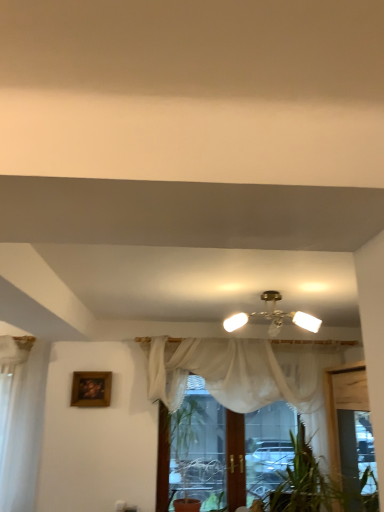
Describe the element at coordinates (91, 389) in the screenshot. I see `wooden framed painting at upper left` at that location.

The height and width of the screenshot is (512, 384). Find the location of `white sheer curtain at center`. white sheer curtain at center is located at coordinates (240, 370).

From a real-world perspective, is wooden framed painting at upper left physically above matte brass chandelier at center?

Actually, wooden framed painting at upper left is physically below matte brass chandelier at center in the real world.

What's the angular difference between wooden framed painting at upper left and matte brass chandelier at center's facing directions?

The facing directions of wooden framed painting at upper left and matte brass chandelier at center are 92.1 degrees apart.

Considering the relative sizes of wooden framed painting at upper left and matte brass chandelier at center in the image provided, is wooden framed painting at upper left thinner than matte brass chandelier at center?

Indeed, wooden framed painting at upper left has a lesser width compared to matte brass chandelier at center.

Is wooden framed painting at upper left taller than matte brass chandelier at center?

Yes.

Is wooden framed painting at upper left oriented towards white sheer curtain at center?

No, wooden framed painting at upper left is not aimed at white sheer curtain at center.

From the image's perspective, is wooden framed painting at upper left on top of white sheer curtain at center?

Indeed, from the image's perspective, wooden framed painting at upper left is shown above white sheer curtain at center.

Is wooden framed painting at upper left at the left side of white sheer curtain at center?

Indeed, wooden framed painting at upper left is positioned on the left side of white sheer curtain at center.

From the picture: Considering the sizes of wooden framed painting at upper left and white sheer curtain at center in the image, is wooden framed painting at upper left wider or thinner than white sheer curtain at center?

In the image, wooden framed painting at upper left appears to be more narrow than white sheer curtain at center.

From a real-world perspective, between white sheer curtain at center and matte brass chandelier at center, who is vertically lower?

white sheer curtain at center.

This screenshot has height=512, width=384. Identify the location of curtain located on the left of matte brass chandelier at center. (240, 370).

Is white sheer curtain at center outside of matte brass chandelier at center?

Indeed, white sheer curtain at center is completely outside matte brass chandelier at center.

Based on the photo, from the image's perspective, is white sheer curtain at center located above matte brass chandelier at center?

Incorrect, from the image's perspective, white sheer curtain at center is lower than matte brass chandelier at center.

Which is more to the left, matte brass chandelier at center or white sheer curtain at center?

From the viewer's perspective, white sheer curtain at center appears more on the left side.

What's the angular difference between matte brass chandelier at center and white sheer curtain at center's facing directions?

They differ by 91.9 degrees in their facing directions.

Is matte brass chandelier at center not near white sheer curtain at center?

No, matte brass chandelier at center is in close proximity to white sheer curtain at center.

From a real-world perspective, which is physically above, matte brass chandelier at center or wooden framed painting at upper left?

In real-world perspective, matte brass chandelier at center is above.

From the image's perspective, who appears lower, matte brass chandelier at center or wooden framed painting at upper left?

wooden framed painting at upper left appears lower in the image.

Which is in front, matte brass chandelier at center or wooden framed painting at upper left?

matte brass chandelier at center is more forward.

Could you tell me if white sheer curtain at center is turned towards wooden framed painting at upper left?

No, white sheer curtain at center is not turned towards wooden framed painting at upper left.

Between point (310, 404) and point (72, 399), which one is positioned behind?

The point (72, 399) is farther.

Is white sheer curtain at center smaller than wooden framed painting at upper left?

No.

What are the coordinates of `lamp that is in front of the wooden framed painting at upper left` in the screenshot? It's located at (273, 316).

The height and width of the screenshot is (512, 384). I want to click on picture frame behind the white sheer curtain at center, so click(x=91, y=389).

Estimate the real-world distances between objects in this image. Which object is further from matte brass chandelier at center, white sheer curtain at center or wooden framed painting at upper left?

wooden framed painting at upper left lies further to matte brass chandelier at center than the other object.

Looking at the image, which one is located further to matte brass chandelier at center, wooden framed painting at upper left or white sheer curtain at center?

Based on the image, wooden framed painting at upper left appears to be further to matte brass chandelier at center.

When comparing their distances from white sheer curtain at center, does wooden framed painting at upper left or matte brass chandelier at center seem closer?

matte brass chandelier at center lies closer to white sheer curtain at center than the other object.

Which object lies further to the anchor point wooden framed painting at upper left, white sheer curtain at center or matte brass chandelier at center?

The object further to wooden framed painting at upper left is matte brass chandelier at center.

Looking at this image, considering their positions, is matte brass chandelier at center positioned further to wooden framed painting at upper left than white sheer curtain at center?

matte brass chandelier at center.

Estimate the real-world distances between objects in this image. Which object is further from white sheer curtain at center, matte brass chandelier at center or wooden framed painting at upper left?

wooden framed painting at upper left lies further to white sheer curtain at center than the other object.

The image size is (384, 512). In order to click on curtain between wooden framed painting at upper left and matte brass chandelier at center in this screenshot , I will do `click(240, 370)`.